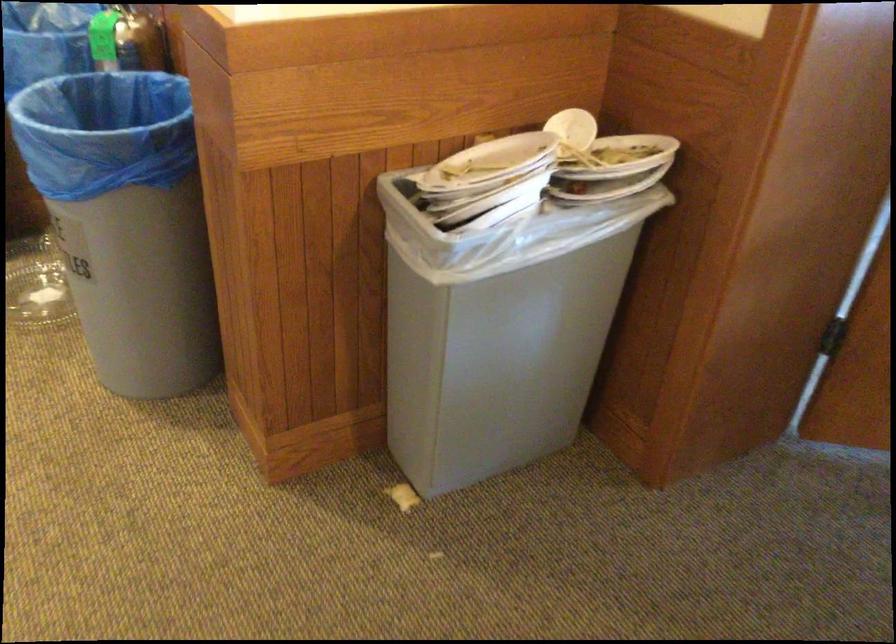
Where is `white bowl`? The height and width of the screenshot is (644, 896). white bowl is located at coordinates (506, 290).